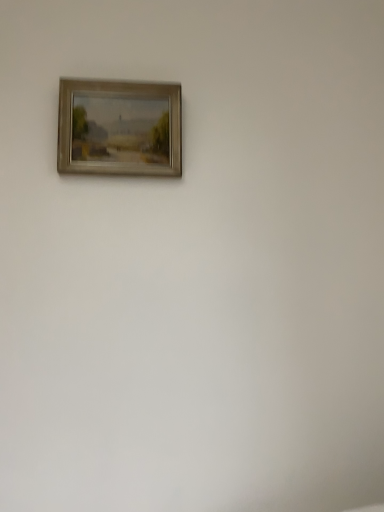
Locate an element on the screen. This screenshot has height=512, width=384. wooden frame painting at upper center is located at coordinates (119, 128).

Measure the distance between wooden frame painting at upper center and camera.

The distance of wooden frame painting at upper center from camera is 1.25 meters.

In order to face wooden frame painting at upper center, should I rotate leftwards or rightwards?

You should look left and rotate roughly 9.510 degrees.

The image size is (384, 512). Describe the element at coordinates (119, 128) in the screenshot. I see `wooden frame painting at upper center` at that location.

Find the location of a particular element. This screenshot has width=384, height=512. wooden frame painting at upper center is located at coordinates (119, 128).